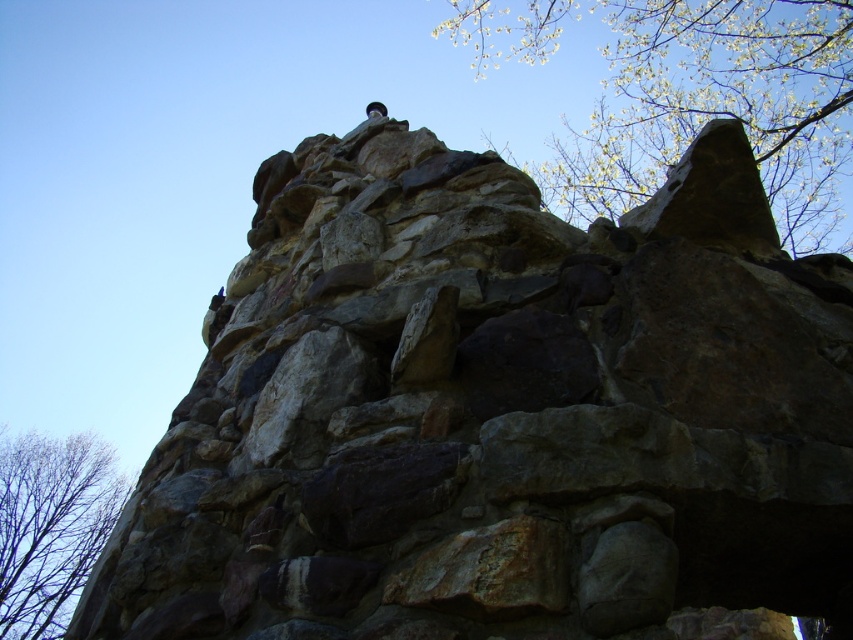
Can you confirm if green leafy tree at upper right is positioned to the right of bare branches at lower left?

Yes, green leafy tree at upper right is to the right of bare branches at lower left.

Looking at this image, which is more to the left, green leafy tree at upper right or bare branches at lower left?

Positioned to the left is bare branches at lower left.

Where is `green leafy tree at upper right`? The height and width of the screenshot is (640, 853). green leafy tree at upper right is located at coordinates (692, 96).